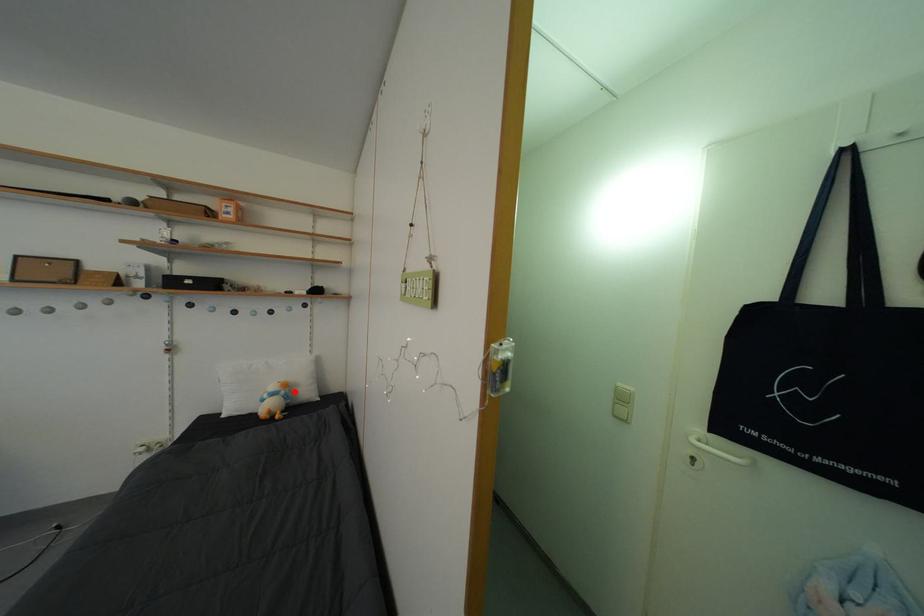
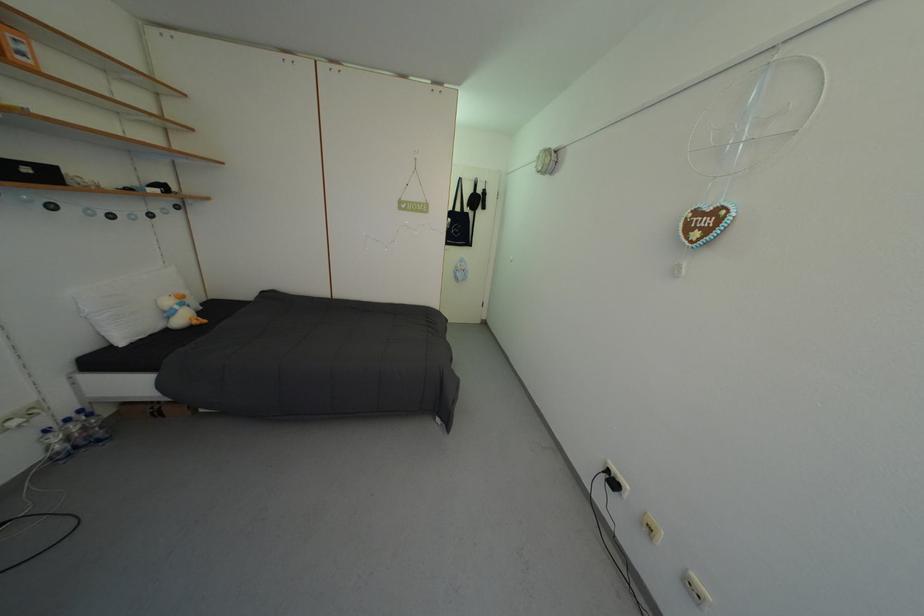
Where in the second image is the point corresponding to the highlighted location from the first image?

(190, 302)